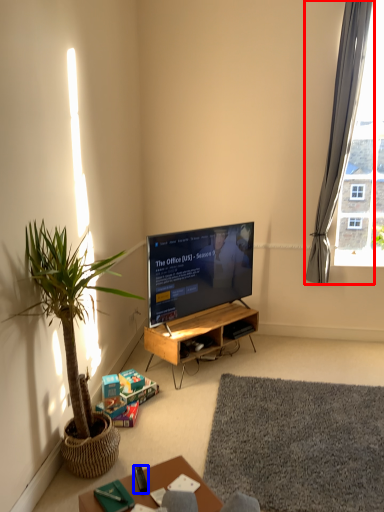
Question: Which point is closer to the camera, curtain (highlighted by a red box) or remote control (highlighted by a blue box)?

Choices:
 (A) curtain
 (B) remote control

Answer: (B)